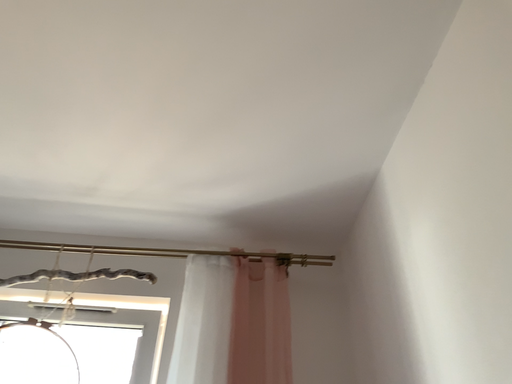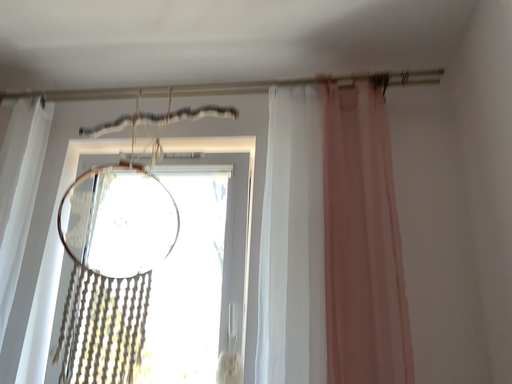
Question: How did the camera likely rotate when shooting the video?

Choices:
 (A) rotated upward
 (B) rotated downward

Answer: (B)